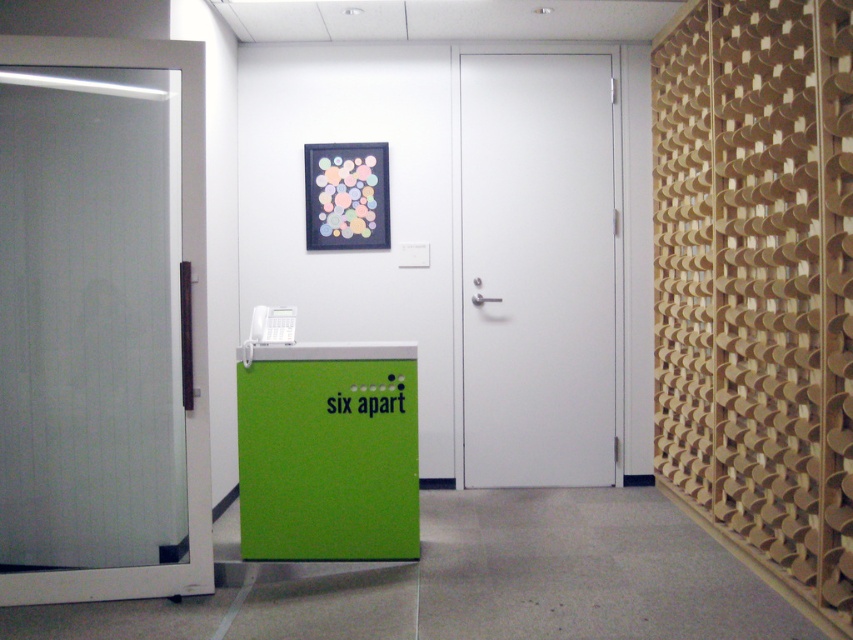
Question: Which object is farther from the camera taking this photo?

Choices:
 (A) transparent glass door at left
 (B) white smooth door at center
 (C) wooden slats at right

Answer: (B)

Question: Based on their relative distances, which object is farther from the matte plastic bulletin board at center?

Choices:
 (A) green matte locker at center
 (B) transparent glass door at left
 (C) white smooth door at center
 (D) wooden slats at right

Answer: (D)

Question: Which point is farther to the camera?

Choices:
 (A) white smooth door at center
 (B) wooden slats at right
 (C) transparent glass door at left

Answer: (A)

Question: Is the position of wooden slats at right more distant than that of matte plastic bulletin board at center?

Choices:
 (A) no
 (B) yes

Answer: (A)

Question: Is transparent glass door at left wider than matte plastic bulletin board at center?

Choices:
 (A) no
 (B) yes

Answer: (B)

Question: Does wooden slats at right lie in front of transparent glass door at left?

Choices:
 (A) yes
 (B) no

Answer: (A)